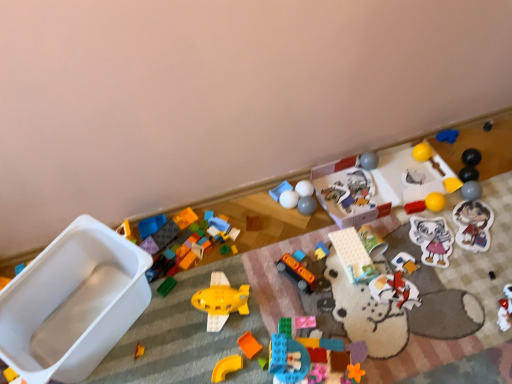
Locate an element on the screen. free space that is in between white matte figure at center, placed as the seventh toy when sorted from right to left, and pink matte block at center, acting as the 14th toy starting from the right is located at coordinates (347, 302).